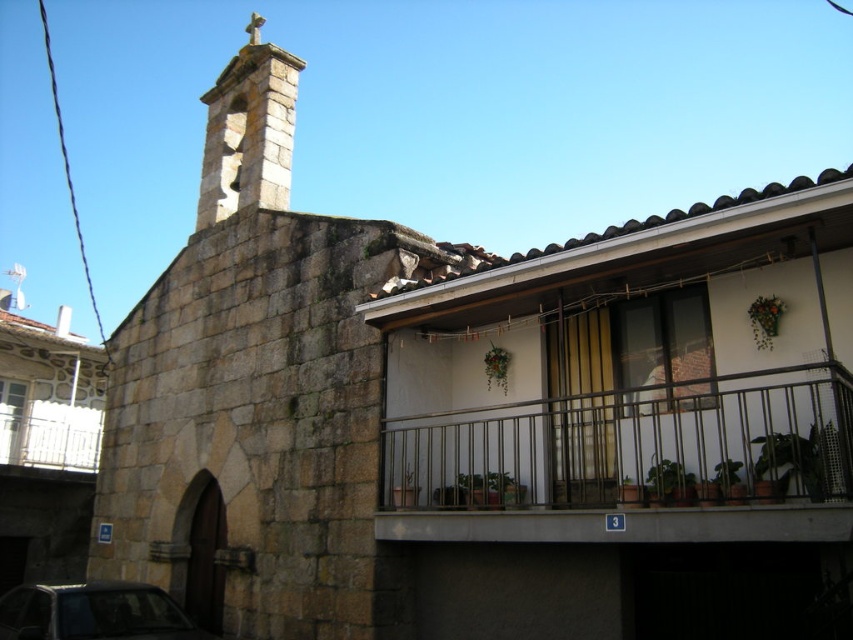
You are standing in front of the stone chapel and the residential building with a modern balcony. You notice two points marked in the scene. The first point is at coordinates point (764, 422) and the second is at point (10, 593). Which of these two points is closer to your current position?

Point (764, 422) is closer to the camera than point (10, 593).

You are a delivery person trying to park your shiny black car at lower left in front of the white metal balcony at upper left. Based on the scene, can your car fit in the available space between the chapel and the residential building?

The shiny black car at lower left is wider than the white metal balcony at upper left, so it may not fit in the available space between the chapel and the residential building.